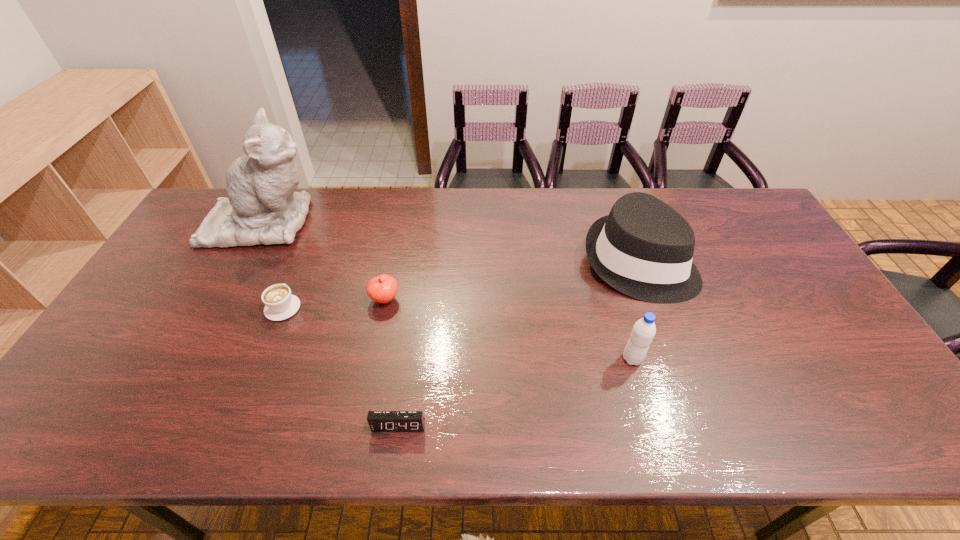
Find the location of `free space located 0.320m to the right of the cappuccino's handle`. free space located 0.320m to the right of the cappuccino's handle is located at coordinates (317, 223).

The image size is (960, 540). What are the coordinates of `vacant point located 0.150m to the right of the cappuccino's handle` in the screenshot? It's located at (303, 258).

Locate an element on the screen. Image resolution: width=960 pixels, height=540 pixels. free location located to the right of the cappuccino's handle is located at coordinates (294, 281).

Where is `cat present at the far edge`? This screenshot has height=540, width=960. cat present at the far edge is located at coordinates (262, 208).

What are the coordinates of `fedora situated at the far edge` in the screenshot? It's located at (644, 248).

This screenshot has width=960, height=540. I want to click on object that is at the near edge, so click(379, 421).

This screenshot has height=540, width=960. I want to click on object located at the left edge, so click(262, 208).

At what (x,y) coordinates should I click in order to perform the action: click on object that is at the far left corner. Please return your answer as a coordinate pair (x, y). Looking at the image, I should click on (262, 208).

You are a GUI agent. You are given a task and a screenshot of the screen. Output one action in this format:
    pyautogui.click(x=<x>, y=<y>)
    Task: Click on the free region at the far edge of the desktop
    The image size is (960, 540).
    Given the screenshot: What is the action you would take?
    pyautogui.click(x=536, y=194)

Locate an element on the screen. vacant point at the left edge is located at coordinates (201, 282).